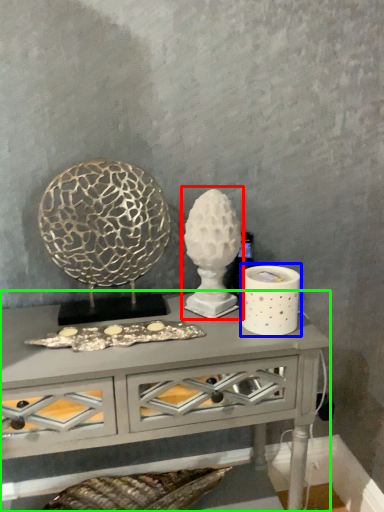
Question: Which is nearer to the sculpture (highlighted by a red box)? candle holder (highlighted by a blue box) or table (highlighted by a green box).

Choices:
 (A) candle holder
 (B) table

Answer: (A)